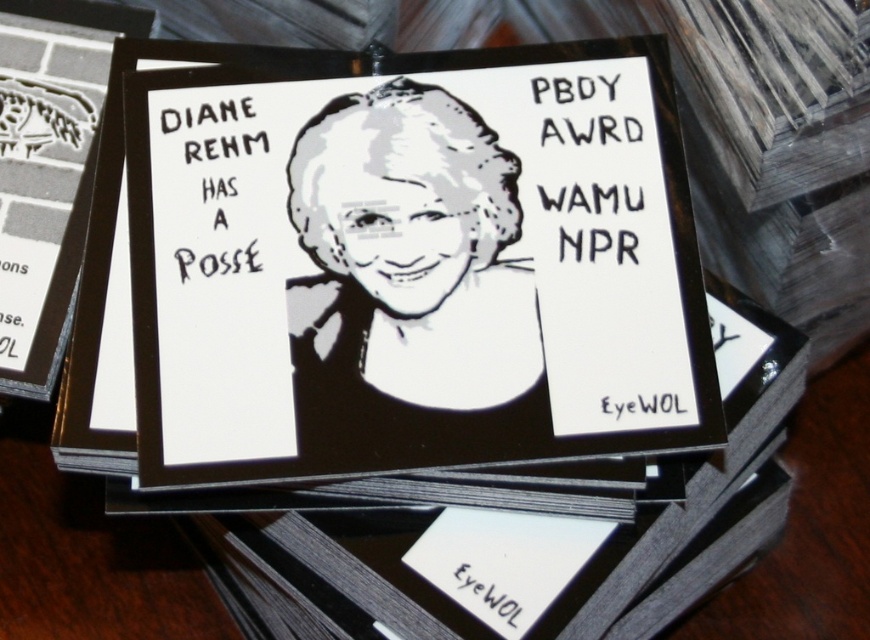
Does black paper card at center have a lesser width compared to black paper portrait at center?

Incorrect, black paper card at center's width is not less than black paper portrait at center's.

Is point (288, 429) closer to viewer compared to point (485, 378)?

Yes, it is in front of point (485, 378).

The image size is (870, 640). Identify the location of black paper card at center. (413, 264).